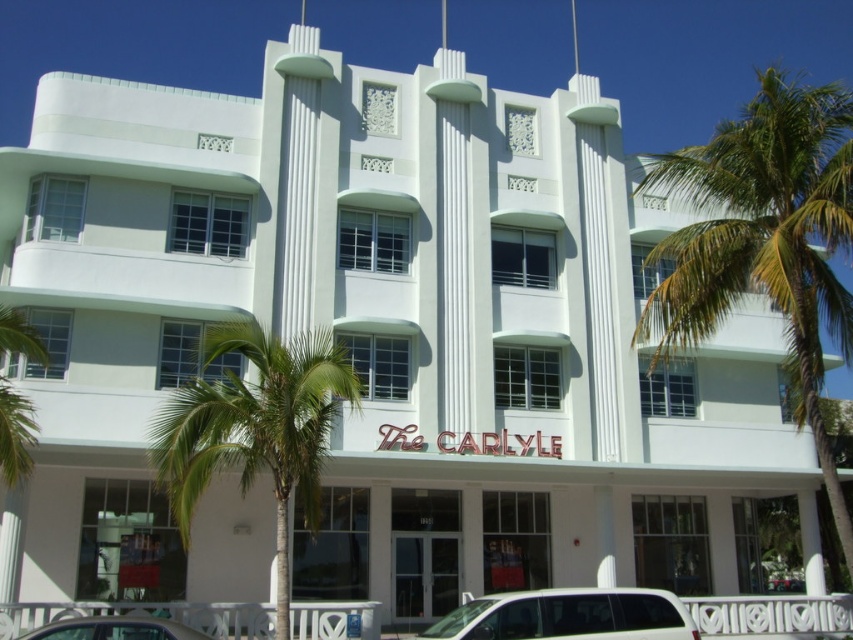
Question: Which point is farther from the camera taking this photo?

Choices:
 (A) tap(125, 637)
 (B) tap(459, 625)
 (C) tap(358, 381)
 (D) tap(804, 99)

Answer: (C)

Question: Does green leafy palm tree at right have a smaller size compared to metallic silver car at lower left?

Choices:
 (A) yes
 (B) no

Answer: (B)

Question: Is green leafy palm tree at right to the right of white glossy van at lower center from the viewer's perspective?

Choices:
 (A) yes
 (B) no

Answer: (A)

Question: Considering the real-world distances, which object is closest to the metallic silver car at lower left?

Choices:
 (A) green leafy palm tree at right
 (B) white glossy van at lower center

Answer: (B)

Question: Can you confirm if green leafy palm tree at center is bigger than metallic silver car at lower left?

Choices:
 (A) no
 (B) yes

Answer: (A)

Question: Which point appears closest to the camera in this image?

Choices:
 (A) (57, 627)
 (B) (844, 221)

Answer: (A)